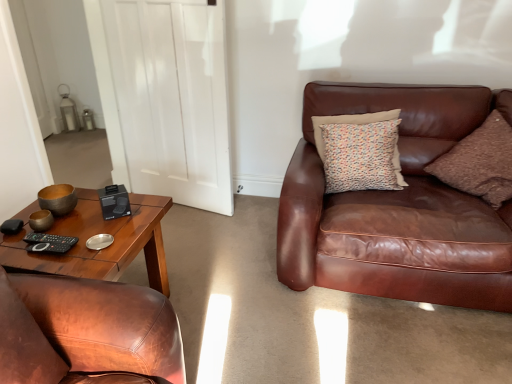
Question: In terms of size, does brown leather couch at right appear bigger or smaller than brown corduroy pillow at right, which ranks as the first pillow in right-to-left order?

Choices:
 (A) small
 (B) big

Answer: (B)

Question: Considering their positions, is brown leather couch at right located in front of or behind brown corduroy pillow at right, which ranks as the first pillow in right-to-left order?

Choices:
 (A) front
 (B) behind

Answer: (A)

Question: Based on their relative distances, which object is nearer to the brown leather couch at right?

Choices:
 (A) multicolored fabric pillow at upper right, placed as the second pillow when sorted from right to left
 (B) brown leather chair at left
 (C) black matte remote at lower left
 (D) matte brown pillow at lower left, arranged as the third pillow when viewed from the right
 (E) brown corduroy pillow at right, which ranks as the first pillow in right-to-left order

Answer: (A)

Question: Which of these objects is positioned farthest from the brown leather couch at right?

Choices:
 (A) black matte remote at lower left
 (B) brown corduroy pillow at right, the 3th pillow viewed from the left
 (C) multicolored fabric pillow at upper right, which is the 1th pillow in back-to-front order
 (D) brown leather chair at left
 (E) matte brown pillow at lower left, which is counted as the first pillow, starting from the front

Answer: (E)